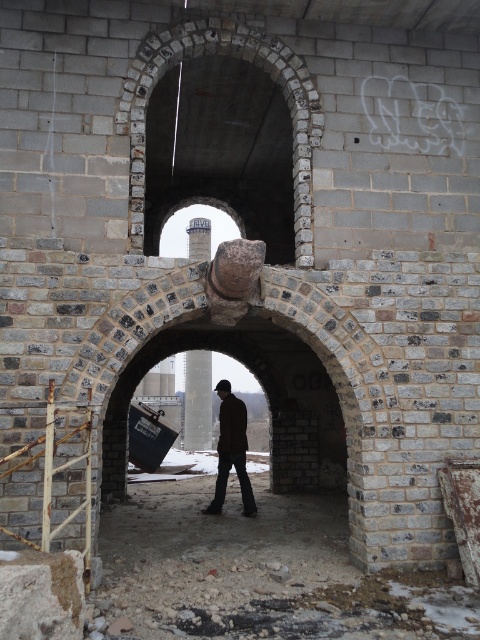
You are an architect examining the brick structure. You notice the brick stone archway at upper center and the brown leather jacket at center. Which object is larger in size?

The brick stone archway at upper center is bigger than the brown leather jacket at center.

You are standing inside the abandoned brick structure and notice the brick stone archway at upper center and the brown leather jacket at center. Which object is located higher up in the image?

The brick stone archway at upper center is positioned over the brown leather jacket at center, so it is higher up in the image.